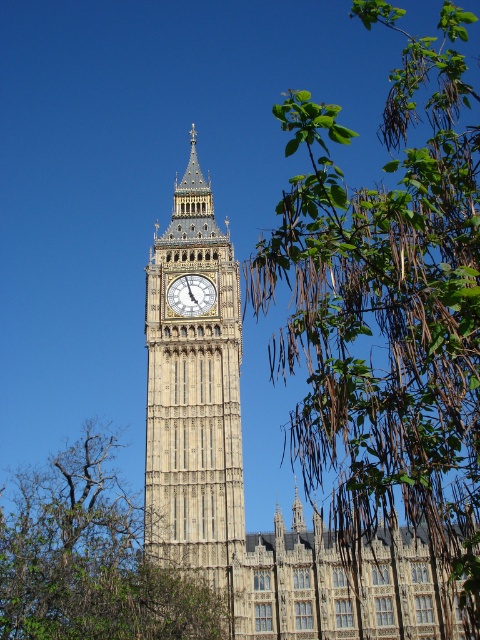
Between green leafy branches at upper right and green leafy tree at lower left, which one appears on the left side from the viewer's perspective?

From the viewer's perspective, green leafy tree at lower left appears more on the left side.

Does green leafy branches at upper right have a larger size compared to green leafy tree at lower left?

Indeed, green leafy branches at upper right has a larger size compared to green leafy tree at lower left.

From the picture: Who is more forward, (476, 275) or (165, 588)?

Positioned in front is point (476, 275).

The width and height of the screenshot is (480, 640). Find the location of `green leafy branches at upper right`. green leafy branches at upper right is located at coordinates (387, 312).

Is green leafy tree at lower left below white stone clock at center?

Indeed, green leafy tree at lower left is positioned under white stone clock at center.

Which is behind, point (120, 532) or point (195, 284)?

Point (195, 284)

The width and height of the screenshot is (480, 640). What are the coordinates of `green leafy tree at lower left` in the screenshot? It's located at (91, 557).

The height and width of the screenshot is (640, 480). Identify the location of green leafy tree at lower left. (91, 557).

Is white stone clock at center thinner than gold textured spire at center?

No.

Which is in front, point (212, 285) or point (297, 497)?

Point (212, 285) is more forward.

Does point (205, 291) come closer to viewer compared to point (296, 524)?

No, (205, 291) is further to viewer.

You are a GUI agent. You are given a task and a screenshot of the screen. Output one action in this format:
    pyautogui.click(x=<x>, y=<y>)
    Task: Click on the white stone clock at center
    
    Given the screenshot: What is the action you would take?
    pyautogui.click(x=191, y=294)